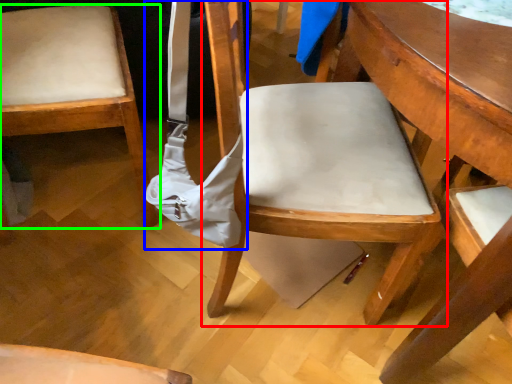
Question: Estimate the real-world distances between objects in this image. Which object is closer to chair (highlighted by a red box), shoulder bag (highlighted by a blue box) or chair (highlighted by a green box)?

Choices:
 (A) shoulder bag
 (B) chair

Answer: (A)